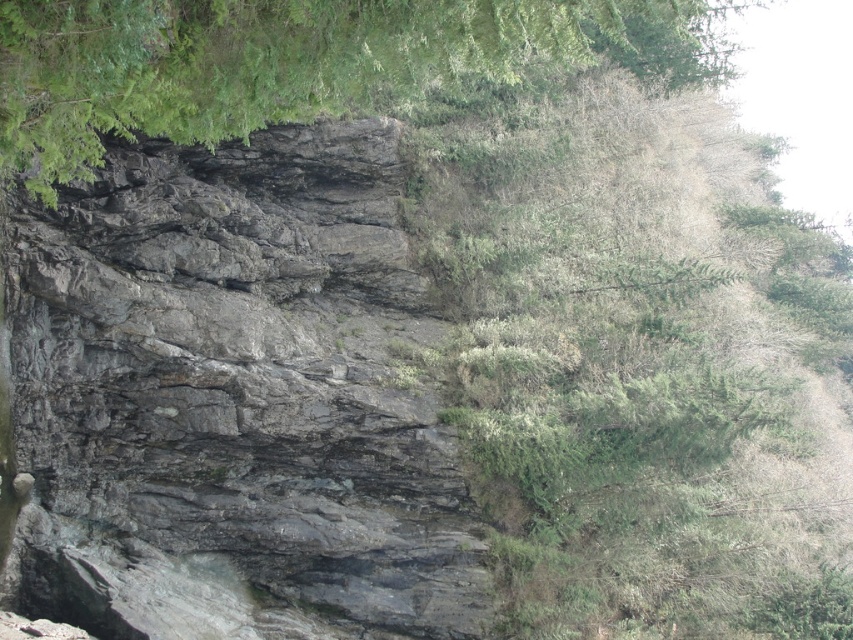
Question: From the image, what is the correct spatial relationship of gray rock at center in relation to green leafy tree at upper center?

Choices:
 (A) below
 (B) above

Answer: (A)

Question: Which point is closer to the camera taking this photo?

Choices:
 (A) (466, 13)
 (B) (96, 547)

Answer: (A)

Question: Is gray rock at center bigger than green leafy tree at upper center?

Choices:
 (A) no
 (B) yes

Answer: (A)

Question: Can you confirm if gray rock at center is smaller than green leafy tree at upper center?

Choices:
 (A) yes
 (B) no

Answer: (A)

Question: Which object appears farthest from the camera in this image?

Choices:
 (A) gray rock at center
 (B) green leafy tree at upper center

Answer: (A)